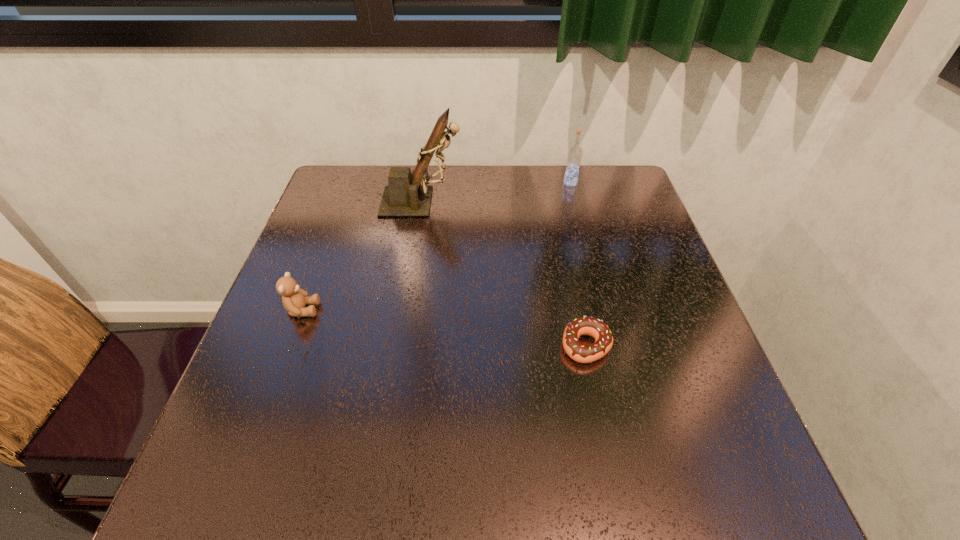
The image size is (960, 540). Find the location of `free spot located 0.250m on the front-facing side of the third farthest object`. free spot located 0.250m on the front-facing side of the third farthest object is located at coordinates (434, 309).

What are the coordinates of `free space located 0.080m on the right of the doughnut` in the screenshot? It's located at (651, 346).

At what (x,y) coordinates should I click in order to perform the action: click on figurine that is positioned at the far edge. Please return your answer as a coordinate pair (x, y). This screenshot has width=960, height=540. Looking at the image, I should click on (404, 196).

What are the coordinates of `vodka located in the far edge section of the desktop` in the screenshot? It's located at pyautogui.click(x=574, y=156).

This screenshot has height=540, width=960. I want to click on object that is positioned at the left edge, so [294, 299].

You are a GUI agent. You are given a task and a screenshot of the screen. Output one action in this format:
    pyautogui.click(x=<x>, y=<y>)
    Task: Click on the object located in the right edge section of the desktop
    
    Given the screenshot: What is the action you would take?
    pyautogui.click(x=574, y=156)

What are the coordinates of `object located in the far right corner section of the desktop` in the screenshot? It's located at (574, 156).

Where is `vacant space at the far edge`? The image size is (960, 540). vacant space at the far edge is located at coordinates (550, 190).

Find the location of `free space at the near edge of the desktop`. free space at the near edge of the desktop is located at coordinates (452, 456).

Where is `vacant area at the left edge of the desktop`? Image resolution: width=960 pixels, height=540 pixels. vacant area at the left edge of the desktop is located at coordinates (301, 436).